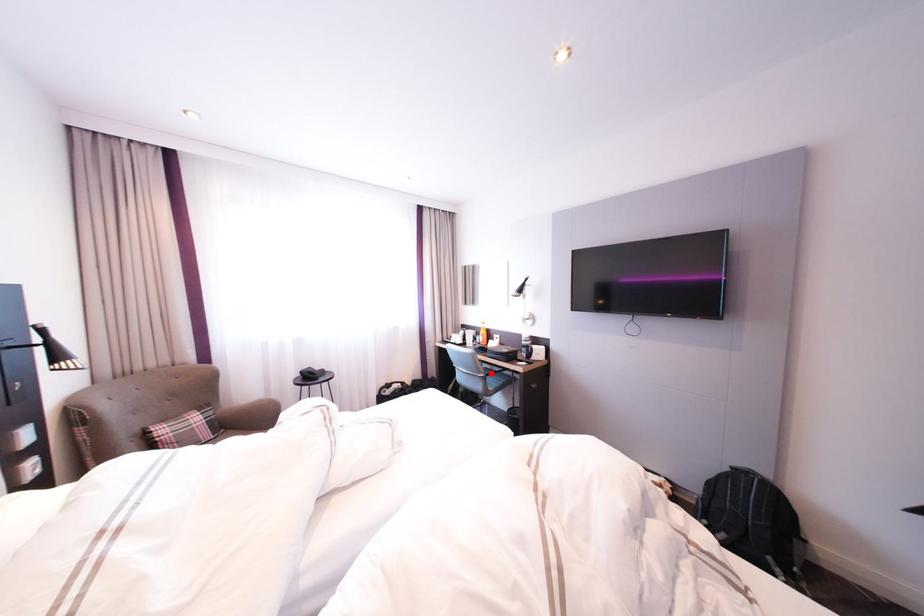
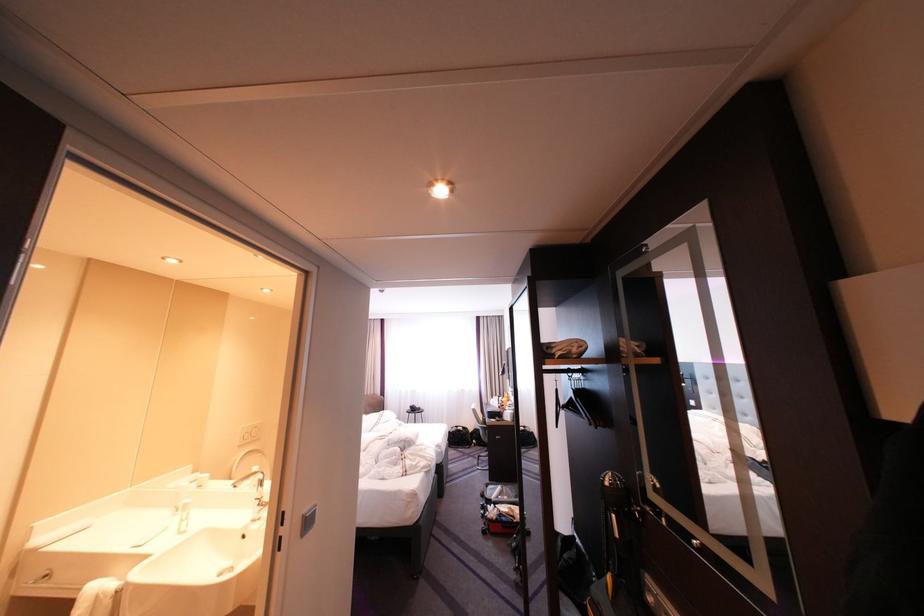
Question: I am providing you with two images of the same scene from different viewpoints. Image1 has a red point marked. In image2, the corresponding 3D location appears at what relative position? Reply with the corresponding letter.

Choices:
 (A) Closer
 (B) Farther

Answer: (B)